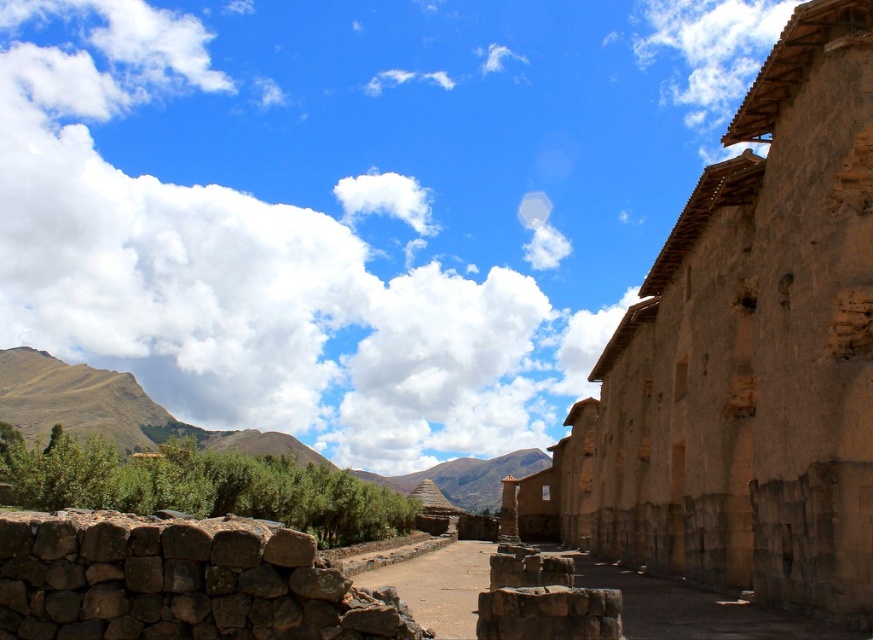
Between brown mudbrick ruins at right and brown stone pillar at center, which one appears on the left side from the viewer's perspective?

brown stone pillar at center

This screenshot has width=873, height=640. Identify the location of brown mudbrick ruins at right. (746, 356).

What do you see at coordinates (746, 356) in the screenshot?
I see `brown mudbrick ruins at right` at bounding box center [746, 356].

Where is `brown mudbrick ruins at right`? This screenshot has width=873, height=640. brown mudbrick ruins at right is located at coordinates (746, 356).